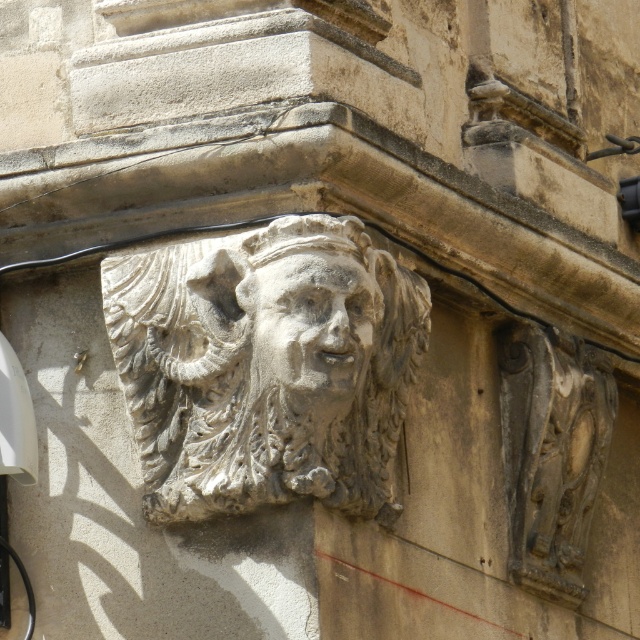
Can you confirm if carved stone mask at upper right is taller than carved stone face at center?

Correct, carved stone mask at upper right is much taller as carved stone face at center.

Which is behind, point (509, 528) or point (356, 328)?

Point (509, 528)

Image resolution: width=640 pixels, height=640 pixels. Find the location of `carved stone mask at upper right`. carved stone mask at upper right is located at coordinates (552, 451).

Is gray stone face at center wider than carved stone face at center?

Correct, the width of gray stone face at center exceeds that of carved stone face at center.

Is gray stone face at center positioned before carved stone face at center?

That is False.

You are a GUI agent. You are given a task and a screenshot of the screen. Output one action in this format:
    pyautogui.click(x=<x>, y=<y>)
    Task: Click on the gray stone face at center
    The width and height of the screenshot is (640, 640).
    Given the screenshot: What is the action you would take?
    pyautogui.click(x=266, y=365)

Between gray stone face at center and carved stone mask at upper right, which one is positioned lower?

carved stone mask at upper right

Where is `gray stone face at center`? This screenshot has height=640, width=640. gray stone face at center is located at coordinates (266, 365).